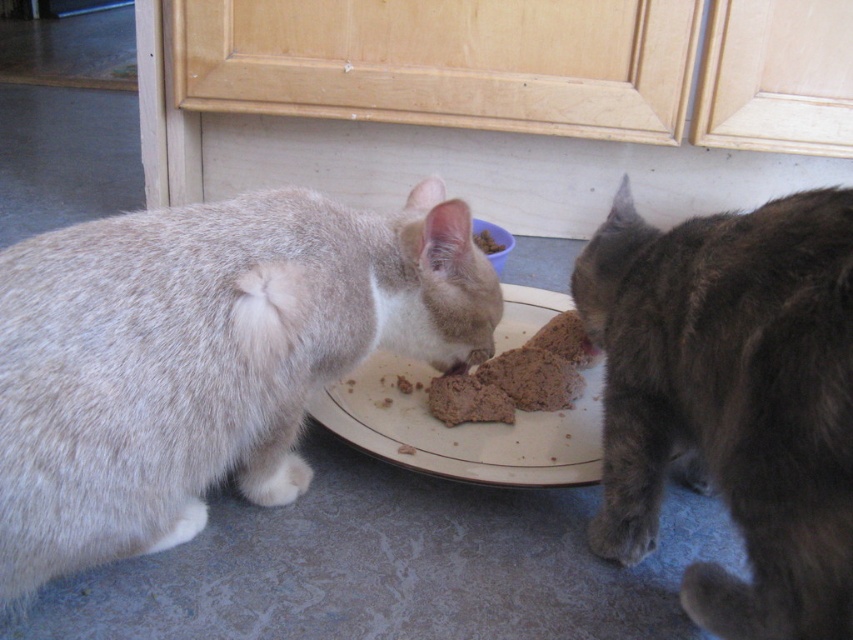
You are a cat owner who wants to ensure your cats have enough space to eat comfortably. Given the current arrangement, can the gray fluffy cat at left comfortably eat from the plate without having to bend down too much compared to the brown crumbly food at center?

The gray fluffy cat at left is much taller than the brown crumbly food at center, so it may need to bend down slightly to eat comfortably. However, since cats are flexible, it should still be able to eat without significant discomfort.

Consider the image. You are a cat owner who wants to ensure your pets have enough space to eat comfortably. Given the scene, can the gray fluffy cat at left and the white glossy plate at center coexist without overcrowding the blue tiled floor?

The gray fluffy cat at left is bigger than the white glossy plate at center, so there should be enough space for both to coexist without overcrowding the blue tiled floor since the cat takes up more space but the plate is smaller.